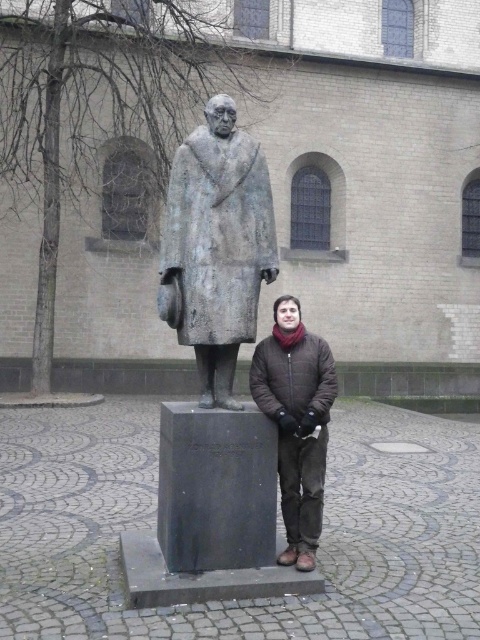
Question: Which of the following is the closest to the observer?

Choices:
 (A) (223, 275)
 (B) (312, 381)

Answer: (A)

Question: Can you confirm if bronze statue at center is smaller than brown quilted jacket at center?

Choices:
 (A) yes
 (B) no

Answer: (B)

Question: Which point is farther to the camera?

Choices:
 (A) bronze statue at center
 (B) brown quilted jacket at center

Answer: (B)

Question: Does bronze statue at center lie in front of brown quilted jacket at center?

Choices:
 (A) no
 (B) yes

Answer: (B)

Question: Can you confirm if bronze statue at center is positioned below brown quilted jacket at center?

Choices:
 (A) no
 (B) yes

Answer: (A)